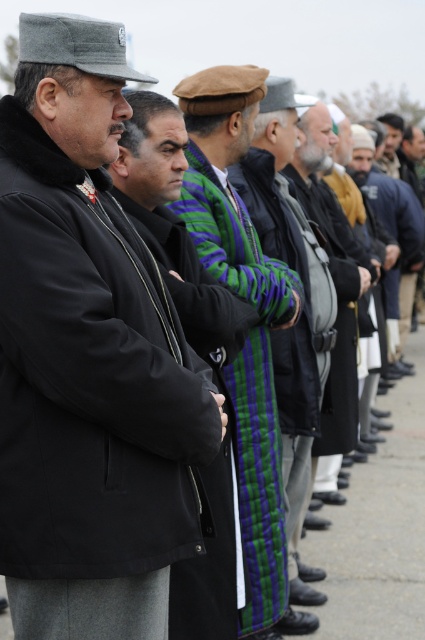
Question: Can you confirm if black woolen jacket at left is bigger than green striped robe at center?

Choices:
 (A) no
 (B) yes

Answer: (B)

Question: Can you confirm if green striped robe at center is bigger than striped wool sweater at center?

Choices:
 (A) yes
 (B) no

Answer: (B)

Question: Which object is farther from the camera taking this photo?

Choices:
 (A) striped wool sweater at center
 (B) green striped scarf at center
 (C) green striped robe at center
 (D) black woolen jacket at left

Answer: (A)

Question: Which point is closer to the camera?

Choices:
 (A) (329, 140)
 (B) (238, 468)
 (C) (291, 268)
 (D) (192, 545)

Answer: (D)

Question: Which object appears farthest from the camera in this image?

Choices:
 (A) black woolen jacket at left
 (B) striped wool sweater at center
 (C) green striped scarf at center

Answer: (B)

Question: Can you confirm if black matte coat at center is bigger than green striped scarf at center?

Choices:
 (A) yes
 (B) no

Answer: (B)